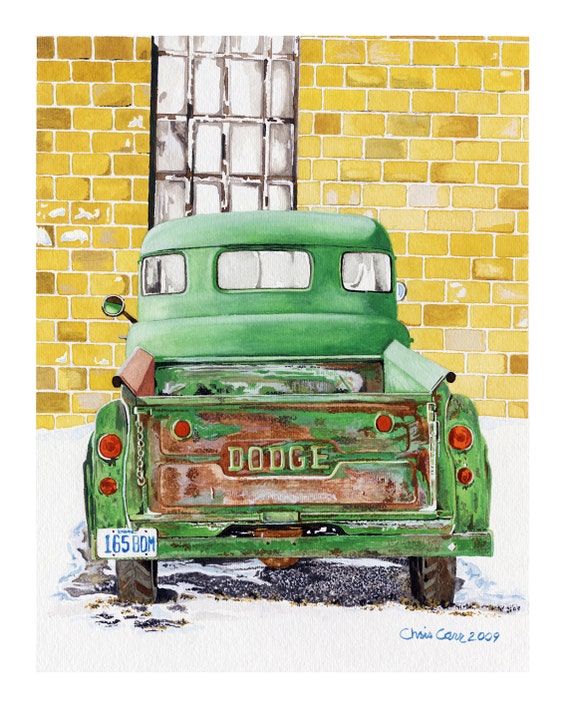
What are the coordinates of `wall` in the screenshot? It's located at (74, 209), (459, 152).